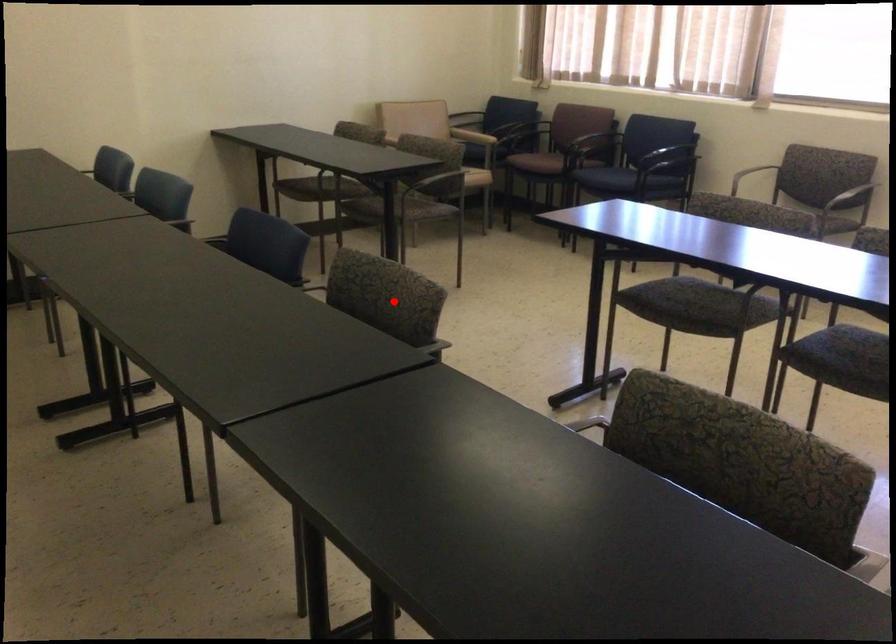
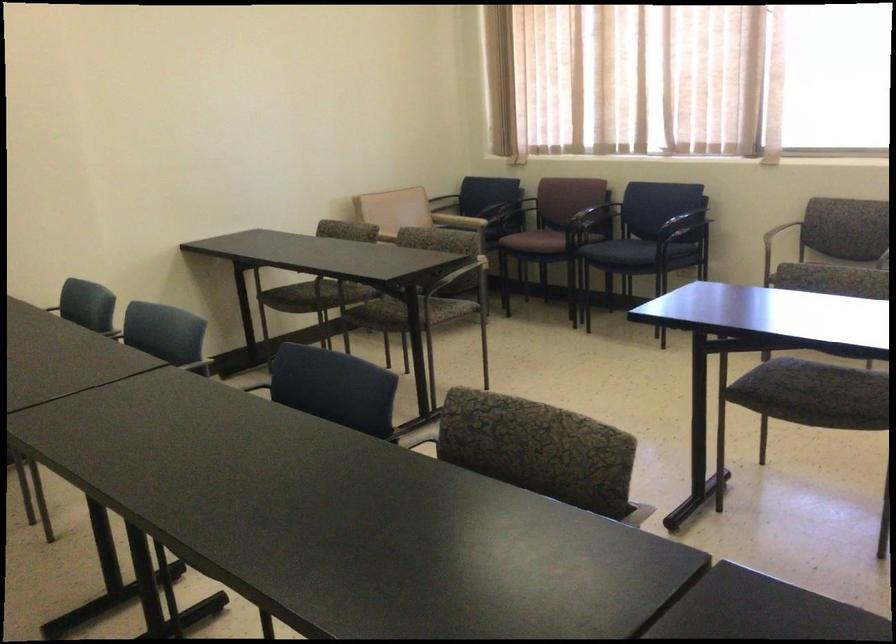
The point at the highlighted location is marked in the first image. Where is the corresponding point in the second image?

(538, 449)